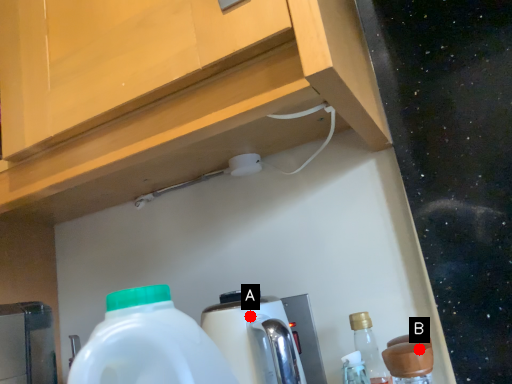
Question: Two points are circled on the image, labeled by A and B beside each circle. Which point is closer to the camera?

Choices:
 (A) A is closer
 (B) B is closer

Answer: (B)